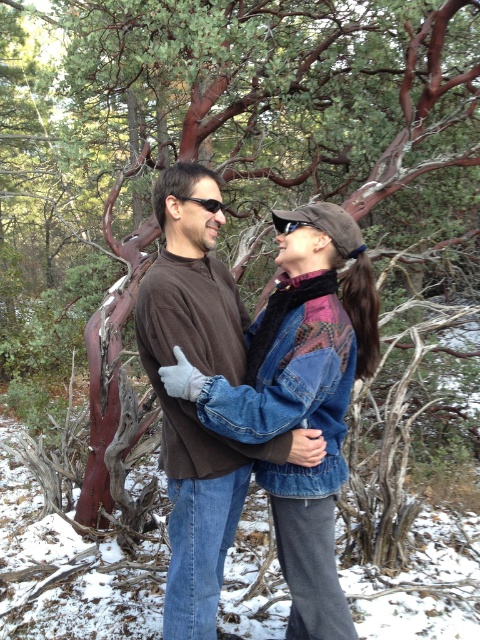
Between brown sweater at center and clear plastic goggles at upper center, which one is positioned higher?

Positioned higher is clear plastic goggles at upper center.

Does brown sweater at center appear on the left side of clear plastic goggles at upper center?

Indeed, brown sweater at center is positioned on the left side of clear plastic goggles at upper center.

The width and height of the screenshot is (480, 640). I want to click on brown sweater at center, so click(x=192, y=403).

Which is above, brown sweater at center or black plastic sunglasses at upper center?

black plastic sunglasses at upper center is above.

Which of these two, brown sweater at center or black plastic sunglasses at upper center, stands taller?

brown sweater at center is taller.

I want to click on brown sweater at center, so click(192, 403).

Which is more to the left, clear plastic goggles at upper center or black plastic sunglasses at upper center?

From the viewer's perspective, black plastic sunglasses at upper center appears more on the left side.

Based on the photo, can you confirm if clear plastic goggles at upper center is wider than black plastic sunglasses at upper center?

In fact, clear plastic goggles at upper center might be narrower than black plastic sunglasses at upper center.

Who is more forward, (292, 228) or (216, 205)?

Point (292, 228)

Identify the location of clear plastic goggles at upper center. The height and width of the screenshot is (640, 480). (288, 225).